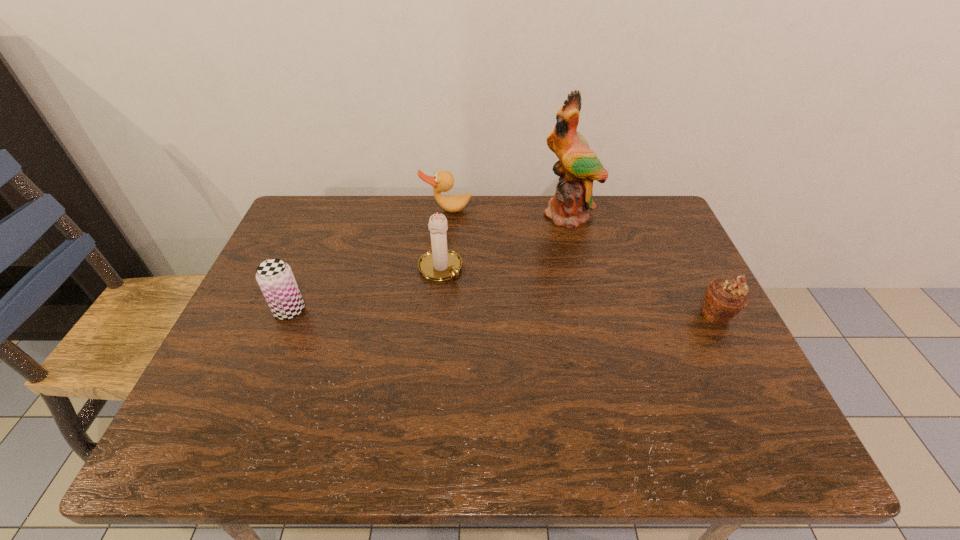
You are a GUI agent. You are given a task and a screenshot of the screen. Output one action in this format:
    pyautogui.click(x=<x>, y=<y>)
    Task: Click on the vacant area between the leftmost object and the duck
    This screenshot has height=540, width=960.
    Given the screenshot: What is the action you would take?
    pyautogui.click(x=368, y=260)

Image resolution: width=960 pixels, height=540 pixels. What are the coordinates of `free space between the duck and the leftmost object` in the screenshot? It's located at (368, 260).

Image resolution: width=960 pixels, height=540 pixels. What are the coordinates of `free space between the duck and the second object from right to left` in the screenshot? It's located at (509, 212).

Identify the location of vacant point located between the rightmost object and the tallest object. (644, 264).

Locate an element on the screen. free space between the duck and the second object from right to left is located at coordinates (509, 212).

Identify which object is the second nearest to the leftmost object. Please provide its 2D coordinates. Your answer should be formatted as a tuple, i.e. [(x, y)], where the tuple contains the x and y coordinates of a point satisfying the conditions above.

[(443, 181)]

Locate an element on the screen. The height and width of the screenshot is (540, 960). the fourth closest object to the beer can is located at coordinates (724, 299).